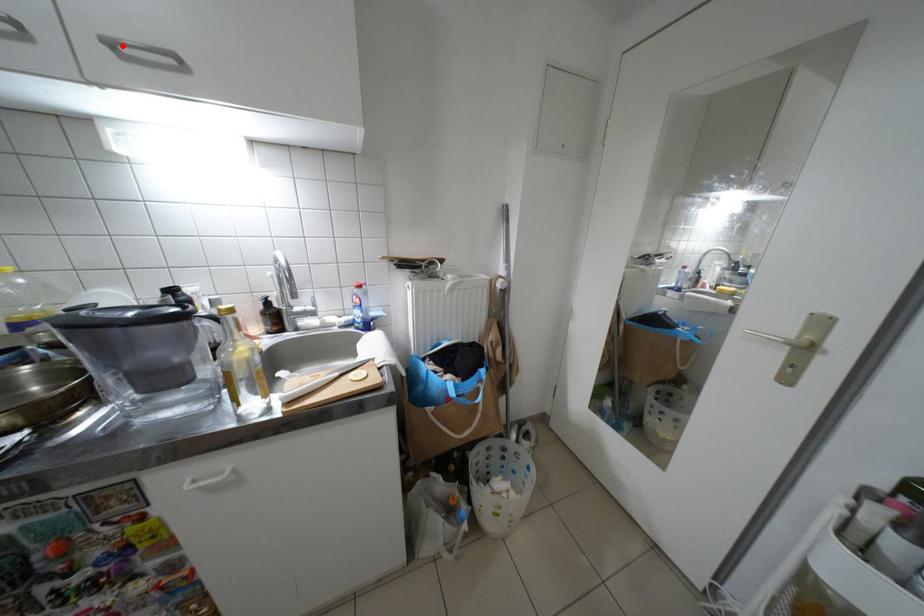
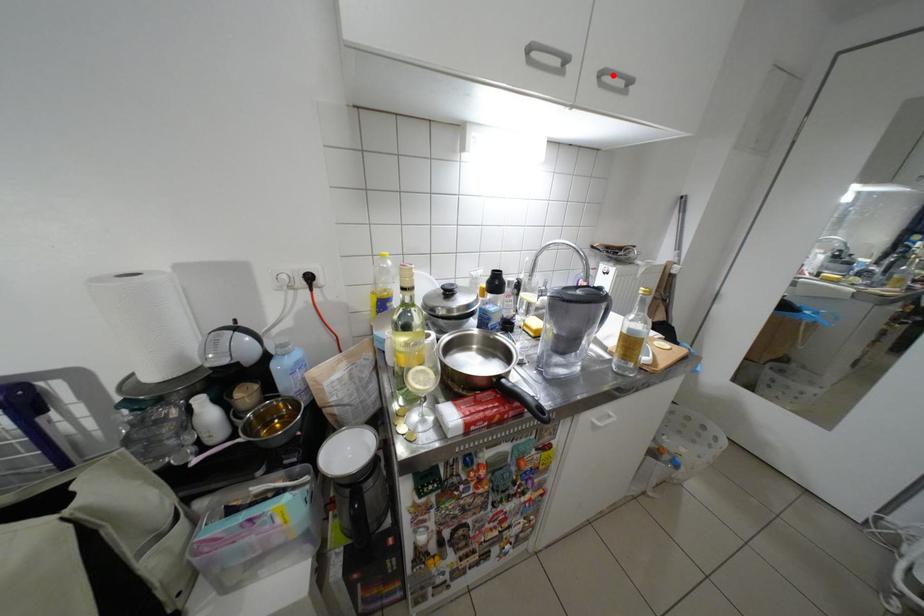
I am providing you with two images of the same scene from different viewpoints. A red point is marked on the first image and another point is marked on the second image. Is the marked point in image1 the same physical position as the marked point in image2?

Yes